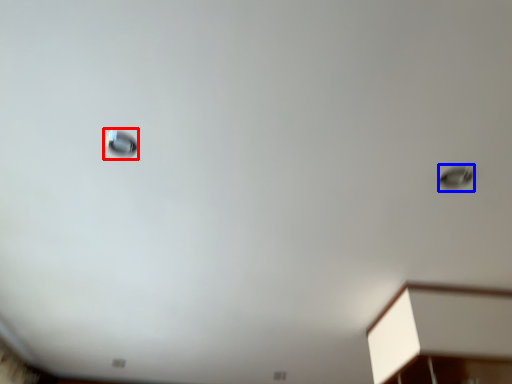
Question: Which object appears closest to the camera in this image, droplight (highlighted by a red box) or droplight (highlighted by a blue box)?

Choices:
 (A) droplight
 (B) droplight

Answer: (A)